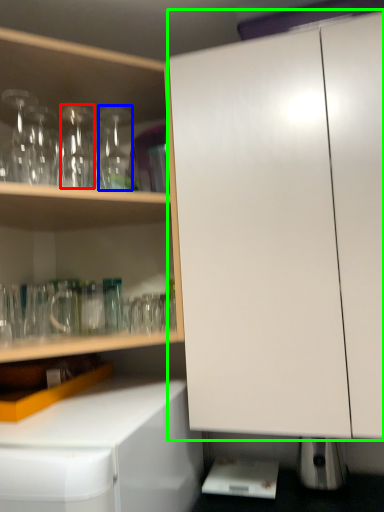
Question: Considering the real-world distances, which object is farthest from bottle (highlighted by a red box)? bottle (highlighted by a blue box) or cabinetry (highlighted by a green box)?

Choices:
 (A) bottle
 (B) cabinetry

Answer: (B)